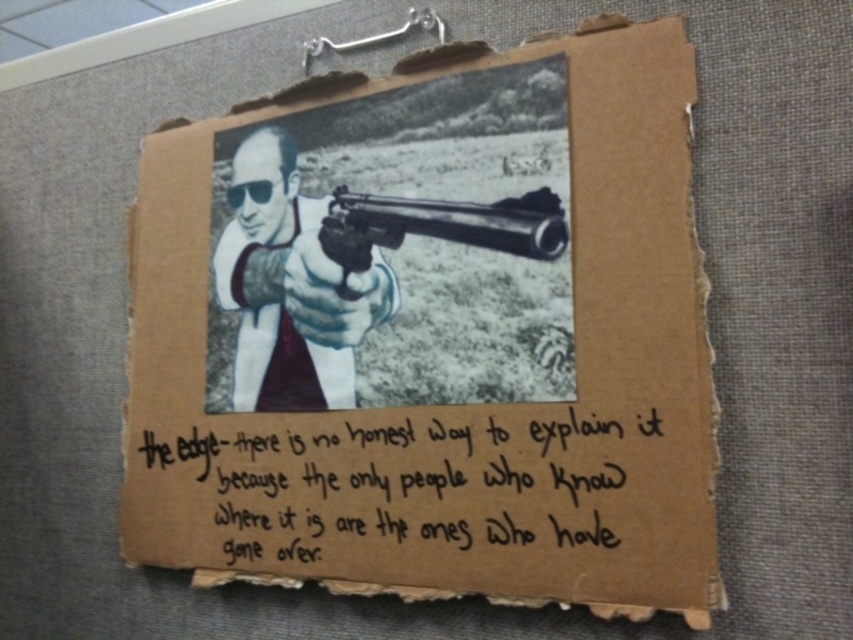
Which is below, brown cardboard at center or polished silver rifle at center?

Positioned lower is brown cardboard at center.

Can you confirm if brown cardboard at center is wider than polished silver rifle at center?

Indeed, brown cardboard at center has a greater width compared to polished silver rifle at center.

This screenshot has height=640, width=853. What are the coordinates of `brown cardboard at center` in the screenshot? It's located at (433, 340).

Identify the location of brown cardboard at center. The width and height of the screenshot is (853, 640). (433, 340).

What do you see at coordinates (396, 490) in the screenshot?
I see `black handwritten text at center` at bounding box center [396, 490].

Is black handwritten text at center to the right of white glossy shirt at center from the viewer's perspective?

Indeed, black handwritten text at center is positioned on the right side of white glossy shirt at center.

Where is `black handwritten text at center`? black handwritten text at center is located at coordinates (396, 490).

Who is more distant from viewer, (x=628, y=333) or (x=363, y=337)?

Positioned behind is point (x=363, y=337).

Image resolution: width=853 pixels, height=640 pixels. I want to click on brown cardboard at center, so click(x=433, y=340).

Identify the location of brown cardboard at center. This screenshot has height=640, width=853. 433,340.